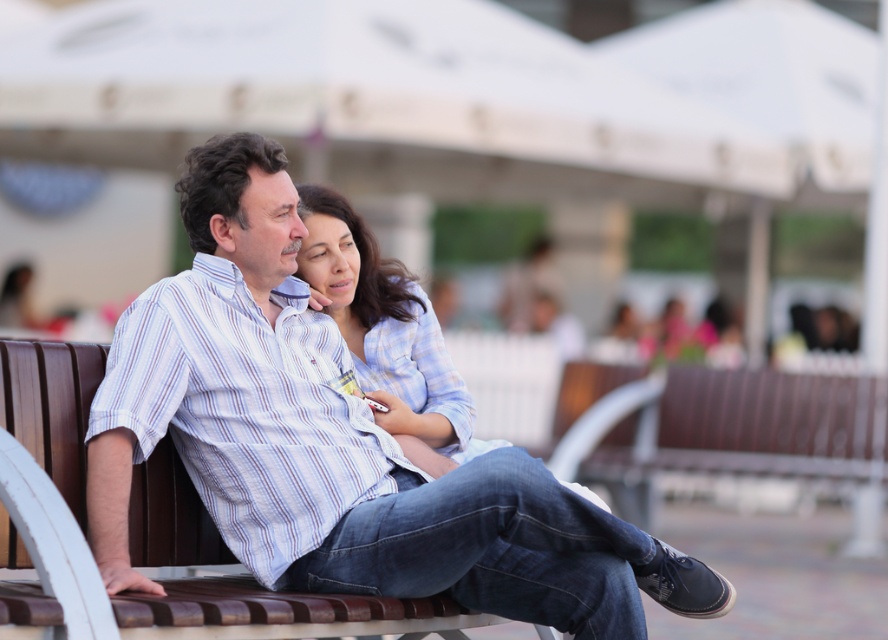
You are a photographer who wants to capture a closeup shot of the blue plaid shirt at center without including the brown wooden bench at center in the frame. Is this possible given their relative sizes?

The brown wooden bench at center is larger in size than the blue plaid shirt at center, so it might be challenging to frame the blue plaid shirt at center without including the bench due to its larger size taking up more space in the scene.

You are a photographer trying to capture a closeup of the couple on the bench. You want to focus on the point at coordinates point (280, 352) and point (52, 531). Which point should you adjust your focus to prioritize if you want the foreground subject to be sharp?

Point (52, 531) should be prioritized for focus since it is in the foreground, closer to the viewer than point (280, 352) which is behind it.